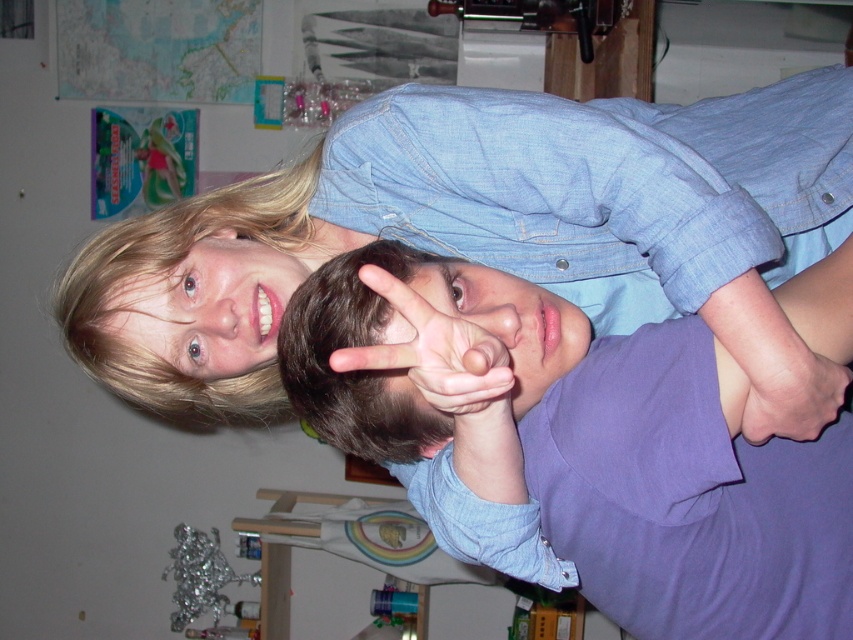
Who is taller, blue denim shirt at upper center or purple cotton shirt at center?

Standing taller between the two is blue denim shirt at upper center.

Is point (763, 116) positioned after point (354, 442)?

Yes, it is behind point (354, 442).

Locate an element on the screen. Image resolution: width=853 pixels, height=640 pixels. blue denim shirt at upper center is located at coordinates tap(459, 218).

Does blue denim shirt at upper center appear on the right side of matte skin hand at center?

Incorrect, blue denim shirt at upper center is not on the right side of matte skin hand at center.

Which of these two, blue denim shirt at upper center or matte skin hand at center, stands shorter?

With less height is matte skin hand at center.

Is point (735, 106) closer to camera compared to point (341, 362)?

No, it is not.

The image size is (853, 640). Find the location of `blue denim shirt at upper center`. blue denim shirt at upper center is located at coordinates (459, 218).

Which of these two, blue denim shirt at upper center or pink flesh-toned hand at lower right, stands shorter?

With less height is pink flesh-toned hand at lower right.

Can you confirm if blue denim shirt at upper center is wider than pink flesh-toned hand at lower right?

Yes.

Does point (219, 273) come in front of point (811, 385)?

No, it is behind (811, 385).

The height and width of the screenshot is (640, 853). What are the coordinates of `blue denim shirt at upper center` in the screenshot? It's located at (459, 218).